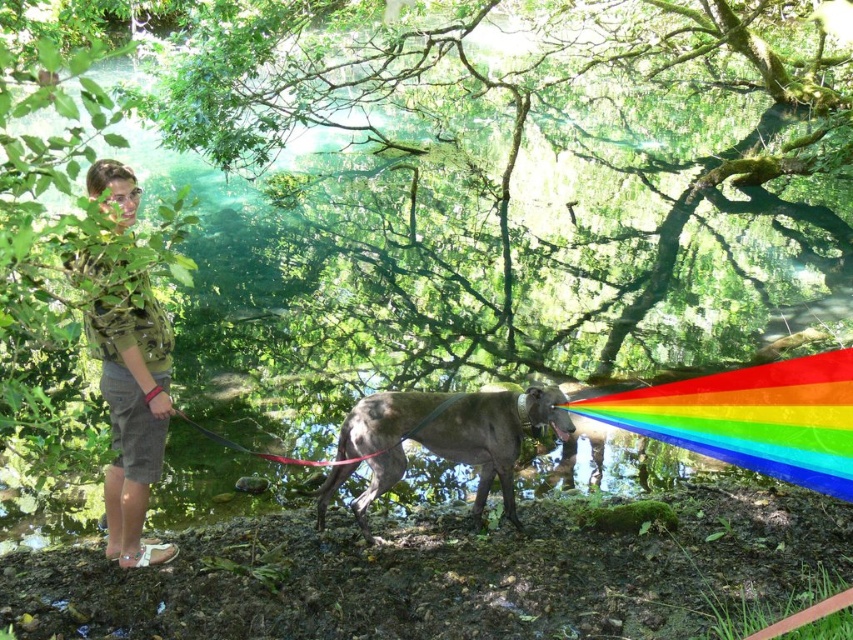
Does rainbow plastic at center lie in front of green camouflage shirt at upper left?

No.

Does rainbow plastic at center lie behind green camouflage shirt at upper left?

Yes, it is behind green camouflage shirt at upper left.

Identify the location of rainbow plastic at center. (751, 417).

Where is `rainbow plastic at center`? The image size is (853, 640). rainbow plastic at center is located at coordinates (751, 417).

Can you confirm if green camouflage shirt at upper left is positioned to the left of smooth brown pony at center?

Yes, green camouflage shirt at upper left is to the left of smooth brown pony at center.

How much distance is there between green camouflage shirt at upper left and smooth brown pony at center?

green camouflage shirt at upper left is 4.58 feet away from smooth brown pony at center.

Is point (131, 442) positioned in front of point (374, 445)?

Yes, point (131, 442) is in front of point (374, 445).

This screenshot has width=853, height=640. Identify the location of green camouflage shirt at upper left. (132, 420).

At what (x,y) coordinates should I click in order to perform the action: click on rainbow plastic at center. Please return your answer as a coordinate pair (x, y). The image size is (853, 640). Looking at the image, I should click on (751, 417).

Is rainbow plastic at center shorter than smooth brown pony at center?

Correct, rainbow plastic at center is not as tall as smooth brown pony at center.

From the picture: Who is more distant from viewer, (808, 358) or (515, 401)?

Point (808, 358)

What are the coordinates of `rainbow plastic at center` in the screenshot? It's located at (751, 417).